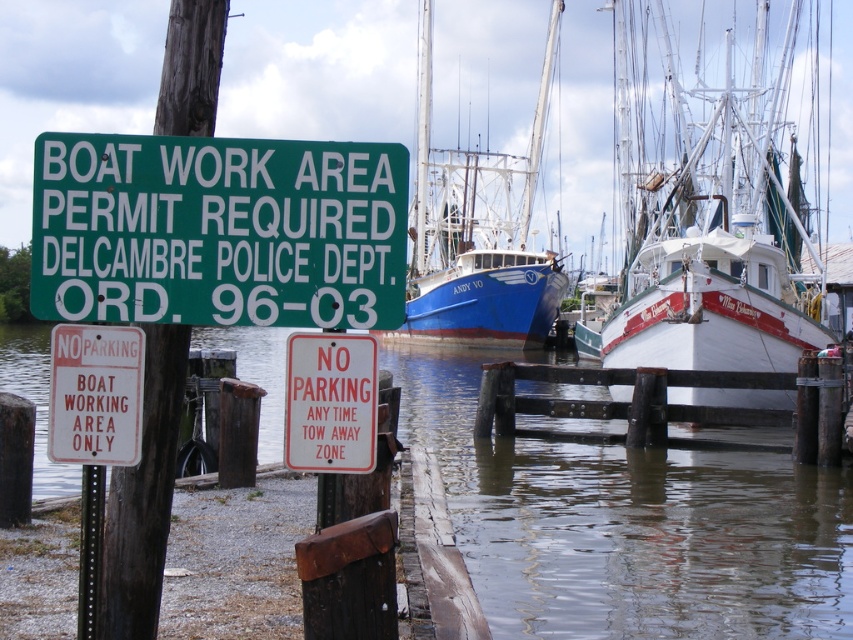
Which is more to the right, white paper sign at lower left or red plastic sign at center?

Positioned to the right is red plastic sign at center.

Can you confirm if white paper sign at lower left is wider than red plastic sign at center?

Yes.

Is point (135, 397) more distant than point (361, 388)?

Yes, point (135, 397) is farther from viewer.

Where is `white paper sign at lower left`? The image size is (853, 640). white paper sign at lower left is located at coordinates (96, 394).

Who is positioned more to the left, blue matte boat at center or red plastic sign at center?

red plastic sign at center

Is blue matte boat at center bigger than red plastic sign at center?

Correct, blue matte boat at center is larger in size than red plastic sign at center.

Describe the element at coordinates (479, 234) in the screenshot. I see `blue matte boat at center` at that location.

Locate an element on the screen. Image resolution: width=853 pixels, height=640 pixels. blue matte boat at center is located at coordinates (479, 234).

Does blue matte boat at center appear under white paper sign at lower left?

Actually, blue matte boat at center is above white paper sign at lower left.

Locate an element on the screen. Image resolution: width=853 pixels, height=640 pixels. blue matte boat at center is located at coordinates (479, 234).

This screenshot has height=640, width=853. Find the location of `blue matte boat at center`. blue matte boat at center is located at coordinates click(x=479, y=234).

Find the location of a particular element. The width and height of the screenshot is (853, 640). blue matte boat at center is located at coordinates click(479, 234).